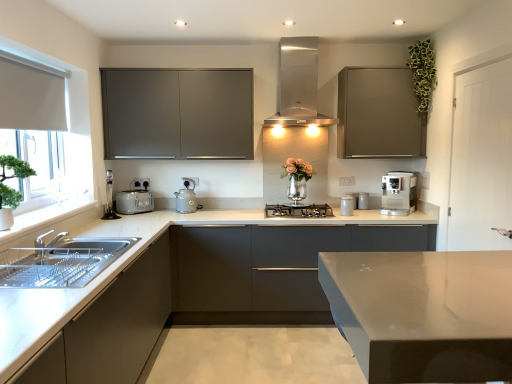
Question: Can you confirm if matte gray kettle at center, which ranks as the second appliance in back-to-front order, is positioned to the right of satin silver coffee machine at right, the 2th home appliance when ordered from top to bottom?

Choices:
 (A) no
 (B) yes

Answer: (A)

Question: Does matte gray kettle at center, which ranks as the second appliance in back-to-front order, contain satin silver coffee machine at right, positioned as the 1th home appliance in right-to-left order?

Choices:
 (A) no
 (B) yes

Answer: (A)

Question: Can you confirm if matte gray kettle at center, which is the first appliance from left to right, is taller than satin silver coffee machine at right, the 2th home appliance when ordered from top to bottom?

Choices:
 (A) no
 (B) yes

Answer: (A)

Question: Can you confirm if matte gray kettle at center, which ranks as the second appliance in back-to-front order, is bigger than satin silver coffee machine at right, which appears as the second home appliance when ordered from the bottom?

Choices:
 (A) yes
 (B) no

Answer: (B)

Question: Does matte gray kettle at center, the 2th appliance viewed from the front, have a lesser width compared to satin silver coffee machine at right, positioned as the 3th home appliance in left-to-right order?

Choices:
 (A) no
 (B) yes

Answer: (B)

Question: From the image's perspective, is stainless steel range hood at center, which is counted as the 3th home appliance, starting from the right, located above or below white fabric at left?

Choices:
 (A) below
 (B) above

Answer: (B)

Question: From a real-world perspective, relative to white fabric at left, is stainless steel range hood at center, the 1th home appliance from the top, vertically above or below?

Choices:
 (A) below
 (B) above

Answer: (B)

Question: Is stainless steel range hood at center, the 1th home appliance from the top, situated inside white fabric at left or outside?

Choices:
 (A) outside
 (B) inside

Answer: (A)

Question: In the image, is stainless steel range hood at center, which is counted as the 3th home appliance, starting from the right, on the left side or the right side of white fabric at left?

Choices:
 (A) left
 (B) right

Answer: (B)

Question: Considering the relative positions of matte gray kettle at center, the third appliance in the right-to-left sequence, and black glass cooktop at center, which is the 2th home appliance in right-to-left order, in the image provided, is matte gray kettle at center, the third appliance in the right-to-left sequence, to the left or to the right of black glass cooktop at center, which is the 2th home appliance in right-to-left order,?

Choices:
 (A) left
 (B) right

Answer: (A)

Question: Does point (185, 185) appear closer or farther from the camera than point (269, 205)?

Choices:
 (A) farther
 (B) closer

Answer: (B)

Question: Considering the positions of matte gray kettle at center, which ranks as the second appliance in back-to-front order, and black glass cooktop at center, which is the 2th home appliance in right-to-left order, in the image, is matte gray kettle at center, which ranks as the second appliance in back-to-front order, bigger or smaller than black glass cooktop at center, which is the 2th home appliance in right-to-left order,?

Choices:
 (A) big
 (B) small

Answer: (B)

Question: Relative to black glass cooktop at center, the first home appliance positioned from the bottom, is matte gray kettle at center, the third appliance in the right-to-left sequence, in front or behind?

Choices:
 (A) behind
 (B) front

Answer: (A)

Question: Which is correct: white marble countertop at lower left, positioned as the first cabinetry in bottom-to-top order, is inside satin silver coffee machine at right, which appears as the second home appliance when ordered from the bottom, or outside of it?

Choices:
 (A) outside
 (B) inside

Answer: (A)

Question: From a real-world perspective, relative to satin silver coffee machine at right, positioned as the 1th home appliance in right-to-left order, is white marble countertop at lower left, the sixth cabinetry positioned from the top, vertically above or below?

Choices:
 (A) below
 (B) above

Answer: (A)